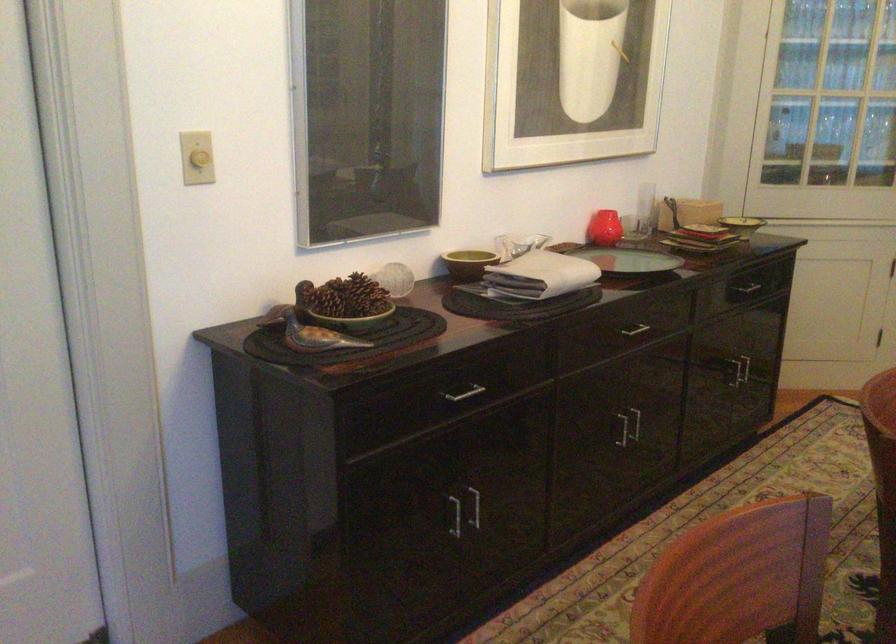
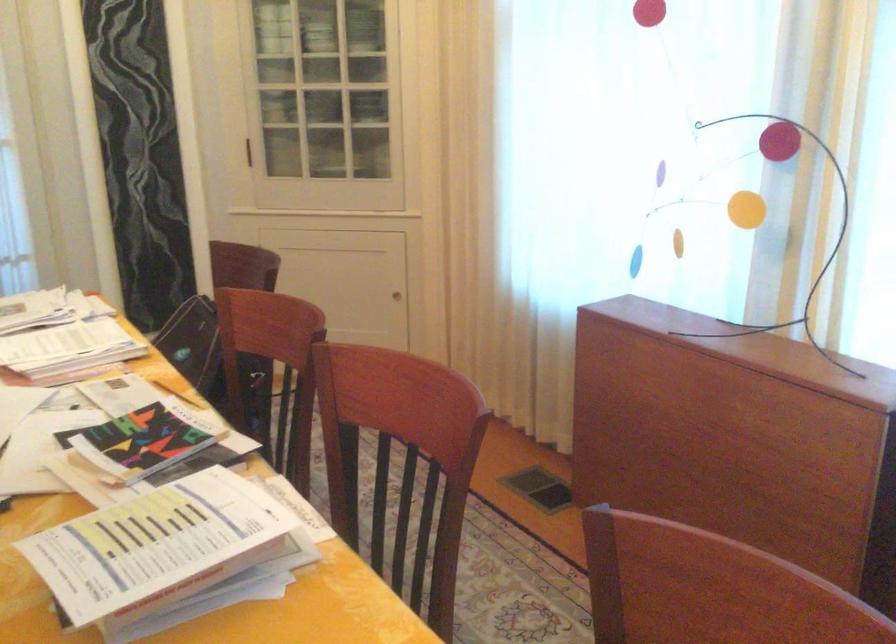
Question: The camera is either moving clockwise (left) or counter-clockwise (right) around the object. The first image is from the beginning of the video and the second image is from the end. Is the camera moving left or right when shooting the video?

Choices:
 (A) Left
 (B) Right

Answer: (A)